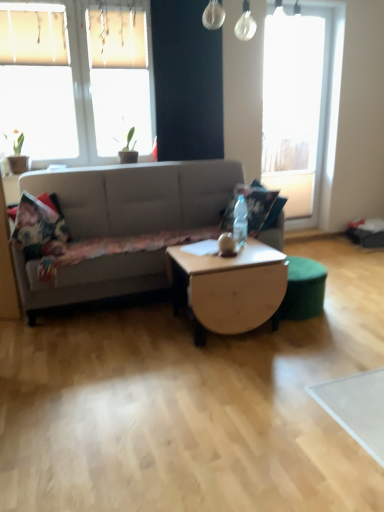
The width and height of the screenshot is (384, 512). What are the coordinates of `vacant space in front of wooden coffee table at center` in the screenshot? It's located at (233, 368).